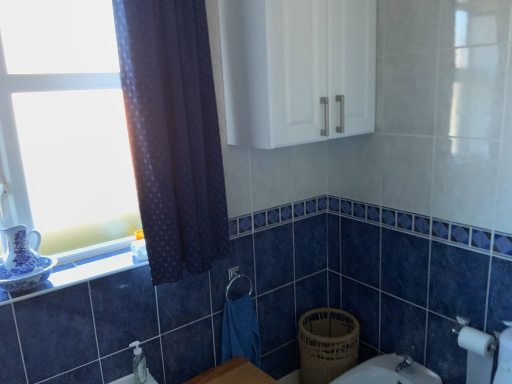
Locate an element on the screen. The image size is (512, 384). empty space that is ontop of woven brown basket at lower right (from a real-world perspective) is located at coordinates (331, 326).